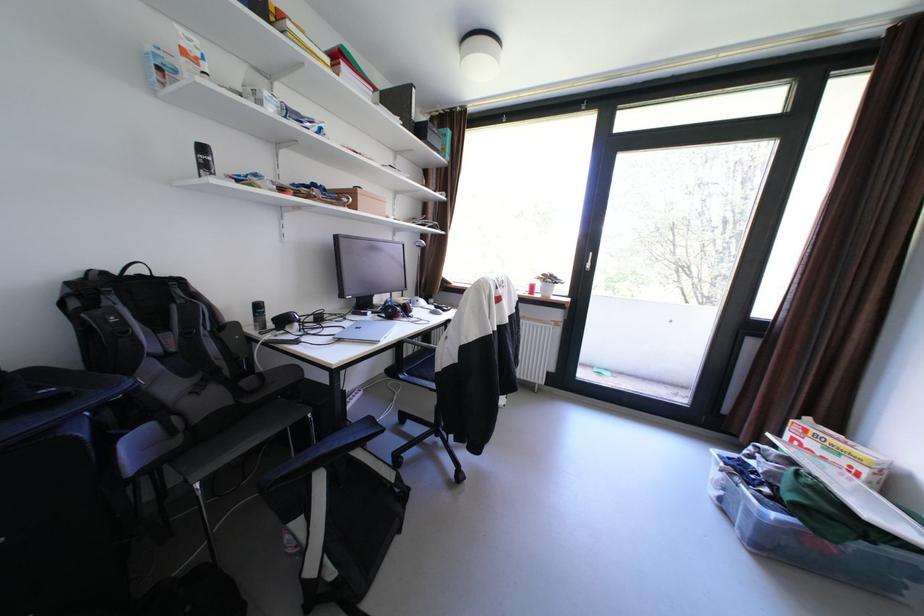
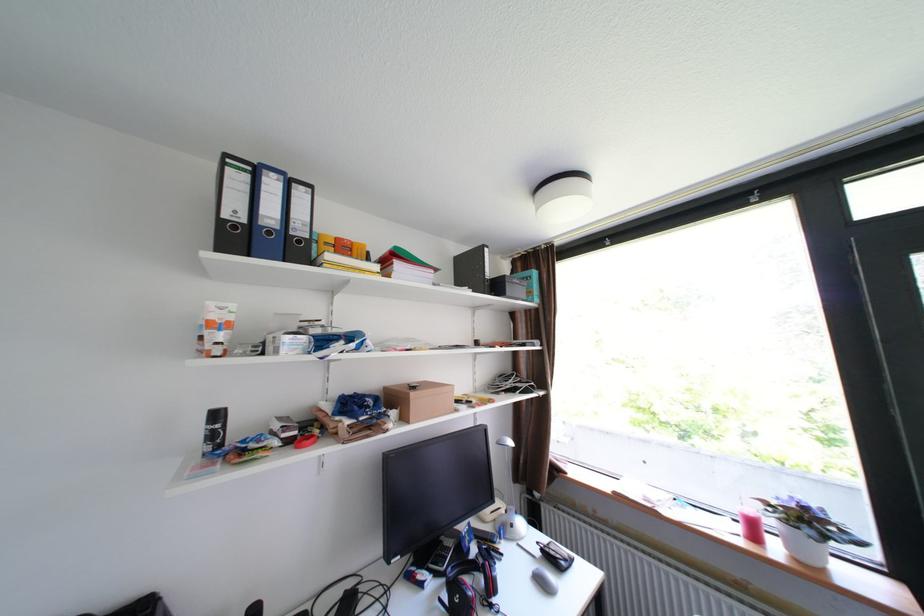
In the second image, find the point that corresponds to (x=383, y=313) in the first image.

(446, 576)